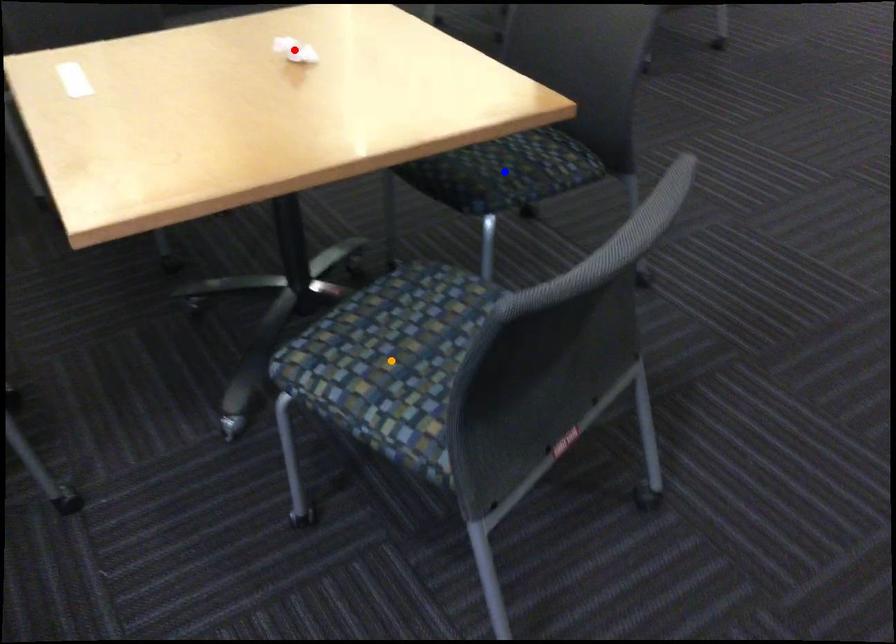
Order these from nearest to farthest:
- orange point
- red point
- blue point

orange point, red point, blue point